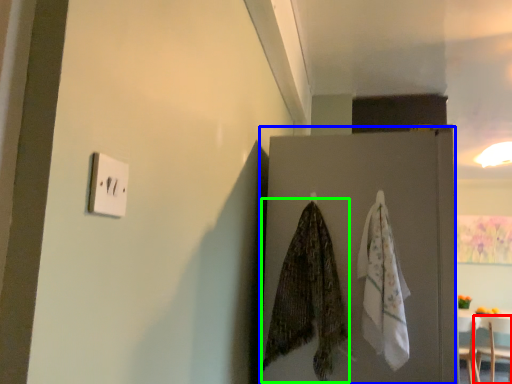
Question: Estimate the real-world distances between objects in this image. Which object is closer to furniture (highlighted by a red box), door (highlighted by a blue box) or clothe (highlighted by a green box)?

Choices:
 (A) door
 (B) clothe

Answer: (A)